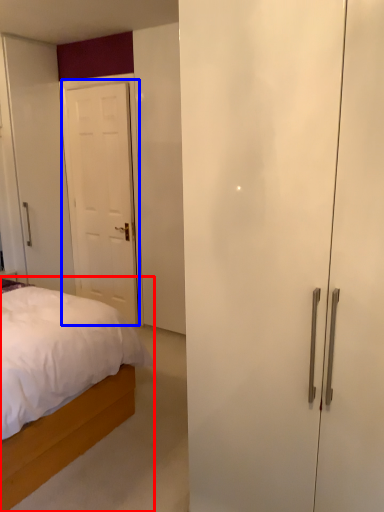
Question: Which point is further to the camera, bed (highlighted by a red box) or door (highlighted by a blue box)?

Choices:
 (A) bed
 (B) door

Answer: (B)